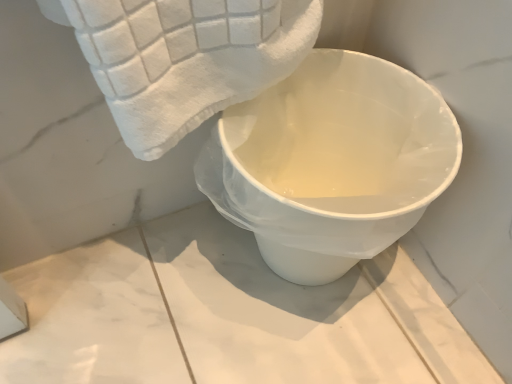
Based on the photo, what is the approximate height of white soft towel at upper left?

white soft towel at upper left is 7.07 inches tall.

The height and width of the screenshot is (384, 512). What do you see at coordinates (187, 58) in the screenshot?
I see `white soft towel at upper left` at bounding box center [187, 58].

Where is `white soft towel at upper left`? The image size is (512, 384). white soft towel at upper left is located at coordinates (187, 58).

The height and width of the screenshot is (384, 512). Describe the element at coordinates (331, 162) in the screenshot. I see `white glossy toilet at center` at that location.

Identify the location of white glossy toilet at center. (331, 162).

Where is `white soft towel at upper left`? The width and height of the screenshot is (512, 384). white soft towel at upper left is located at coordinates (187, 58).

Considering the relative positions of white glossy toilet at center and white soft towel at upper left in the image provided, is white glossy toilet at center to the left or to the right of white soft towel at upper left?

white glossy toilet at center is to the right of white soft towel at upper left.

From the picture: Relative to white soft towel at upper left, is white glossy toilet at center in front or behind?

In the image, white glossy toilet at center appears behind white soft towel at upper left.

Considering the positions of point (202, 156) and point (220, 38), is point (202, 156) closer or farther from the camera than point (220, 38)?

Clearly, point (202, 156) is more distant from the camera than point (220, 38).

From the image's perspective, is white glossy toilet at center above or below white soft towel at upper left?

From the image's perspective, white glossy toilet at center appears below white soft towel at upper left.

From a real-world perspective, which is physically above, white glossy toilet at center or white soft towel at upper left?

In real-world perspective, white soft towel at upper left is above.

Which of these two, white glossy toilet at center or white soft towel at upper left, is wider?

Wider between the two is white glossy toilet at center.

Considering the relative sizes of white glossy toilet at center and white soft towel at upper left in the image provided, is white glossy toilet at center taller than white soft towel at upper left?

Correct, white glossy toilet at center is much taller as white soft towel at upper left.

Considering the sizes of objects white glossy toilet at center and white soft towel at upper left in the image provided, who is smaller, white glossy toilet at center or white soft towel at upper left?

With smaller size is white soft towel at upper left.

Is white glossy toilet at center completely or partially outside of white soft towel at upper left?

Absolutely, white glossy toilet at center is external to white soft towel at upper left.

Is white glossy toilet at center placed right next to white soft towel at upper left?

No.

Is white glossy toilet at center turned away from white soft towel at upper left?

white glossy toilet at center does not have its back to white soft towel at upper left.

Can you tell me how much white glossy toilet at center and white soft towel at upper left differ in facing direction?

2.25 degrees separate the facing orientations of white glossy toilet at center and white soft towel at upper left.

At what (x,y) coordinates should I click in order to perform the action: click on towel above the white glossy toilet at center (from a real-world perspective). Please return your answer as a coordinate pair (x, y). The image size is (512, 384). Looking at the image, I should click on (187, 58).

Considering the relative positions of white soft towel at upper left and white glossy toilet at center in the image provided, is white soft towel at upper left to the left or to the right of white glossy toilet at center?

In the image, white soft towel at upper left appears on the left side of white glossy toilet at center.

Which object is further away from the camera taking this photo, white soft towel at upper left or white glossy toilet at center?

white glossy toilet at center is further from the camera.

Between point (127, 64) and point (279, 216), which one is positioned in front?

The point (127, 64) is in front.

From the picture: From the image's perspective, is white soft towel at upper left located above or below white glossy toilet at center?

Clearly, from the image's perspective, white soft towel at upper left is above white glossy toilet at center.

From a real-world perspective, is white soft towel at upper left physically below white glossy toilet at center?

No, from a real-world perspective, white soft towel at upper left is not below white glossy toilet at center.

Considering the sizes of objects white soft towel at upper left and white glossy toilet at center in the image provided, who is wider, white soft towel at upper left or white glossy toilet at center?

Wider between the two is white glossy toilet at center.

Based on the photo, does white soft towel at upper left have a greater height compared to white glossy toilet at center?

Incorrect, the height of white soft towel at upper left is not larger of that of white glossy toilet at center.

Based on the photo, who is bigger, white soft towel at upper left or white glossy toilet at center?

With larger size is white glossy toilet at center.

Is white soft towel at upper left inside or outside of white glossy toilet at center?

white soft towel at upper left exists outside the volume of white glossy toilet at center.

Is white soft towel at upper left far away from white glossy toilet at center?

Actually, white soft towel at upper left and white glossy toilet at center are a little close together.

Is white soft towel at upper left oriented away from white glossy toilet at center?

No.

How far apart are white soft towel at upper left and white glossy toilet at center?

The distance of white soft towel at upper left from white glossy toilet at center is 6.23 inches.

I want to click on toilet lying on the right of white soft towel at upper left, so click(331, 162).

Where is `toilet behind the white soft towel at upper left`? toilet behind the white soft towel at upper left is located at coordinates (331, 162).

Find the location of a particular element. The height and width of the screenshot is (384, 512). toilet on the right of white soft towel at upper left is located at coordinates (331, 162).